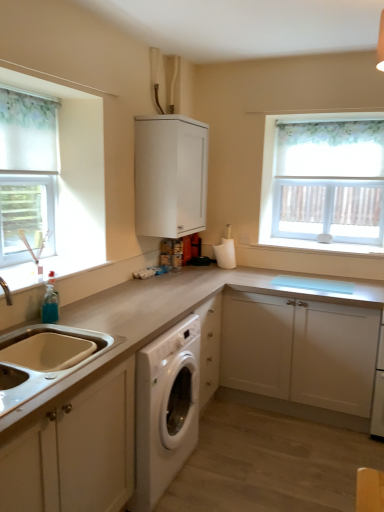
Identify the location of white fabric curtain at left. 27,174.

Looking at this image, in order to face white matte cabinet at upper center, acting as the second cabinetry starting from the left, should I rotate leftwards or rightwards?

To face it directly, rotate left by 2.229 degrees.

Describe the element at coordinates (299, 350) in the screenshot. This screenshot has height=512, width=384. I see `white matte cabinet at center, which is the second cabinetry from front to back` at that location.

Locate an element on the screen. This screenshot has height=512, width=384. white matte toilet paper holder at center is located at coordinates (226, 251).

Locate an element on the screen. This screenshot has height=512, width=384. white matte sink at lower left, which is the 1th cabinetry in left-to-right order is located at coordinates (76, 452).

Describe the element at coordinates (324, 181) in the screenshot. I see `white textured curtain at upper right` at that location.

The width and height of the screenshot is (384, 512). Find the location of `white fabric curtain at left`. white fabric curtain at left is located at coordinates (27, 174).

Which is behind, point (202, 154) or point (76, 490)?

Point (202, 154)

Can you confirm if white matte cabinet at upper center, which is the 1th cabinetry in top-to-bottom order, is shorter than white matte sink at lower left, which is the 2th cabinetry from bottom to top?

No, white matte cabinet at upper center, which is the 1th cabinetry in top-to-bottom order, is not shorter than white matte sink at lower left, which is the 2th cabinetry from bottom to top.

How distant is white matte cabinet at upper center, which appears as the 2th cabinetry when viewed from the right, from white matte sink at lower left, marked as the third cabinetry in a right-to-left arrangement?

1.47 meters.

Is white matte cabinet at upper center, the 3th cabinetry in the front-to-back sequence, at the right side of white matte sink at lower left, acting as the 3th cabinetry starting from the back?

Yes.

From the picture: Which is in front, white matte sink at lower left, which is the 2th cabinetry from bottom to top, or white matte cabinet at center, which is the third cabinetry from left to right?

Positioned in front is white matte sink at lower left, which is the 2th cabinetry from bottom to top.

From the image's perspective, is white matte sink at lower left, which is the second cabinetry from top to bottom, over white matte cabinet at center, arranged as the 3th cabinetry when viewed from the top?

Yes, from the image's perspective, white matte sink at lower left, which is the second cabinetry from top to bottom, is over white matte cabinet at center, arranged as the 3th cabinetry when viewed from the top.

From the picture: Which is more to the right, white matte sink at lower left, which is the 2th cabinetry from bottom to top, or white matte toilet paper holder at center?

From the viewer's perspective, white matte toilet paper holder at center appears more on the right side.

Identify the location of appliance to the right of white matte sink at lower left, which is the second cabinetry from top to bottom. (226, 251).

Who is smaller, white matte sink at lower left, the 1th cabinetry positioned from the front, or white matte toilet paper holder at center?

white matte toilet paper holder at center is smaller.

Does white matte sink at lower left, marked as the third cabinetry in a right-to-left arrangement, come in front of white matte toilet paper holder at center?

Yes, white matte sink at lower left, marked as the third cabinetry in a right-to-left arrangement, is closer to the viewer.

Is white matte cabinet at upper center, which is the 1th cabinetry in top-to-bottom order, behind white fabric curtain at left?

Yes, the depth of white matte cabinet at upper center, which is the 1th cabinetry in top-to-bottom order, is greater than that of white fabric curtain at left.

Is point (142, 137) closer or farther from the camera than point (29, 220)?

Point (142, 137).

Considering the relative positions of white matte cabinet at upper center, which appears as the 2th cabinetry when viewed from the right, and white fabric curtain at left in the image provided, is white matte cabinet at upper center, which appears as the 2th cabinetry when viewed from the right, to the left of white fabric curtain at left from the viewer's perspective?

No.

Is white matte toilet paper holder at center to the left of white matte sink at lower left, which is the second cabinetry from top to bottom, from the viewer's perspective?

No.

Based on their sizes in the image, would you say white matte toilet paper holder at center is bigger or smaller than white matte sink at lower left, which is the 1th cabinetry in left-to-right order?

white matte toilet paper holder at center is smaller than white matte sink at lower left, which is the 1th cabinetry in left-to-right order.

Is white matte toilet paper holder at center next to white matte sink at lower left, acting as the 3th cabinetry starting from the back?

No, white matte toilet paper holder at center is not touching white matte sink at lower left, acting as the 3th cabinetry starting from the back.

Does white matte toilet paper holder at center contain white matte sink at lower left, which is the second cabinetry from top to bottom?

No, white matte sink at lower left, which is the second cabinetry from top to bottom, is not a part of white matte toilet paper holder at center.

Considering the sizes of white matte sink at lower left, which is the 2th cabinetry from bottom to top, and white fabric curtain at left in the image, is white matte sink at lower left, which is the 2th cabinetry from bottom to top, wider or thinner than white fabric curtain at left?

Considering their sizes, white matte sink at lower left, which is the 2th cabinetry from bottom to top, looks broader than white fabric curtain at left.

Is white matte sink at lower left, which is the 2th cabinetry from bottom to top, further to camera compared to white fabric curtain at left?

No, white matte sink at lower left, which is the 2th cabinetry from bottom to top, is in front of white fabric curtain at left.

Are white matte sink at lower left, which is the 1th cabinetry in left-to-right order, and white fabric curtain at left making contact?

No, white matte sink at lower left, which is the 1th cabinetry in left-to-right order, is not in contact with white fabric curtain at left.

From the image's perspective, is white matte sink at lower left, the 1th cabinetry positioned from the front, above white fabric curtain at left?

No, from the image's perspective, white matte sink at lower left, the 1th cabinetry positioned from the front, is not on top of white fabric curtain at left.

Is white matte toilet paper holder at center to the left of white fabric curtain at left from the viewer's perspective?

Incorrect, white matte toilet paper holder at center is not on the left side of white fabric curtain at left.

How many degrees apart are the facing directions of white matte toilet paper holder at center and white fabric curtain at left?

white matte toilet paper holder at center and white fabric curtain at left are facing 91.5 degrees away from each other.

From the image's perspective, which object appears higher, white matte toilet paper holder at center or white fabric curtain at left?

white fabric curtain at left, from the image's perspective.

Which object is closer to the camera taking this photo, white matte toilet paper holder at center or white fabric curtain at left?

Positioned in front is white fabric curtain at left.

From a real-world perspective, starting from the white matte cabinet at upper center, which is the 1th cabinetry in top-to-bottom order, which cabinetry is the 1st one below it? Please provide its 2D coordinates.

[(76, 452)]

This screenshot has height=512, width=384. Identify the location of cabinetry located below the white matte sink at lower left, the 1th cabinetry positioned from the front (from the image's perspective). (299, 350).

From the image, which object appears to be nearer to white fabric curtain at left, white textured curtain at upper right or white matte toilet paper holder at center?

white matte toilet paper holder at center.

Consider the image. From the image, which object appears to be nearer to white matte toilet paper holder at center, white matte sink at lower left, which is the second cabinetry from top to bottom, or white textured curtain at upper right?

white textured curtain at upper right is positioned closer to the anchor white matte toilet paper holder at center.

Considering their positions, is white matte cabinet at upper center, which appears as the 2th cabinetry when viewed from the right, positioned closer to white matte sink at lower left, the 1th cabinetry positioned from the front, than white textured curtain at upper right?

white matte cabinet at upper center, which appears as the 2th cabinetry when viewed from the right, is positioned closer to the anchor white matte sink at lower left, the 1th cabinetry positioned from the front.

Based on the photo, which object lies further to the anchor point white fabric curtain at left, white matte sink at lower left, the 1th cabinetry positioned from the front, or white textured curtain at upper right?

white textured curtain at upper right.

Based on their spatial positions, is white matte toilet paper holder at center or white textured curtain at upper right further from white fabric curtain at left?

white textured curtain at upper right is positioned further to the anchor white fabric curtain at left.

Considering their positions, is white matte sink at lower left, the 1th cabinetry positioned from the front, positioned closer to white matte cabinet at upper center, arranged as the 1th cabinetry when viewed from the back, than white fabric curtain at left?

white fabric curtain at left lies closer to white matte cabinet at upper center, arranged as the 1th cabinetry when viewed from the back, than the other object.

Looking at the image, which one is located closer to white matte sink at lower left, the 1th cabinetry positioned from the front, white fabric curtain at left or white matte toilet paper holder at center?

white fabric curtain at left.

Estimate the real-world distances between objects in this image. Which object is closer to white matte toilet paper holder at center, white textured curtain at upper right or white fabric curtain at left?

white textured curtain at upper right is positioned closer to the anchor white matte toilet paper holder at center.

Where is `cabinetry located between white matte sink at lower left, marked as the third cabinetry in a right-to-left arrangement, and white matte cabinet at upper center, arranged as the 1th cabinetry when viewed from the back, in the depth direction`? Image resolution: width=384 pixels, height=512 pixels. cabinetry located between white matte sink at lower left, marked as the third cabinetry in a right-to-left arrangement, and white matte cabinet at upper center, arranged as the 1th cabinetry when viewed from the back, in the depth direction is located at coordinates (299, 350).

Locate an element on the screen. This screenshot has height=512, width=384. window located between white matte sink at lower left, which is the second cabinetry from top to bottom, and white matte toilet paper holder at center in the depth direction is located at coordinates (324, 181).

The width and height of the screenshot is (384, 512). I want to click on appliance between white fabric curtain at left and white matte cabinet at center, the 1th cabinetry viewed from the right, so click(x=226, y=251).

Locate an element on the screen. The width and height of the screenshot is (384, 512). bay window positioned between white matte sink at lower left, which is the second cabinetry from top to bottom, and white matte toilet paper holder at center from near to far is located at coordinates (27, 174).